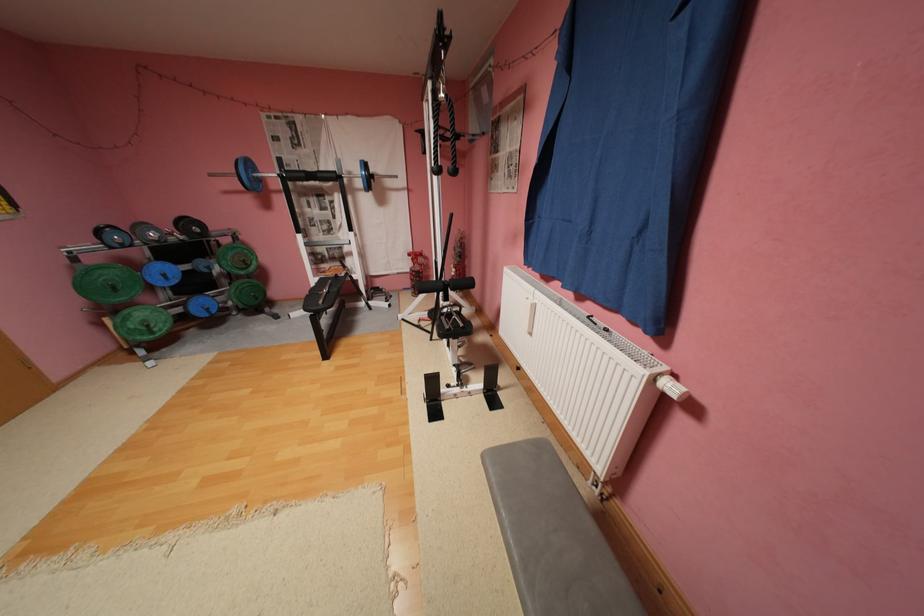
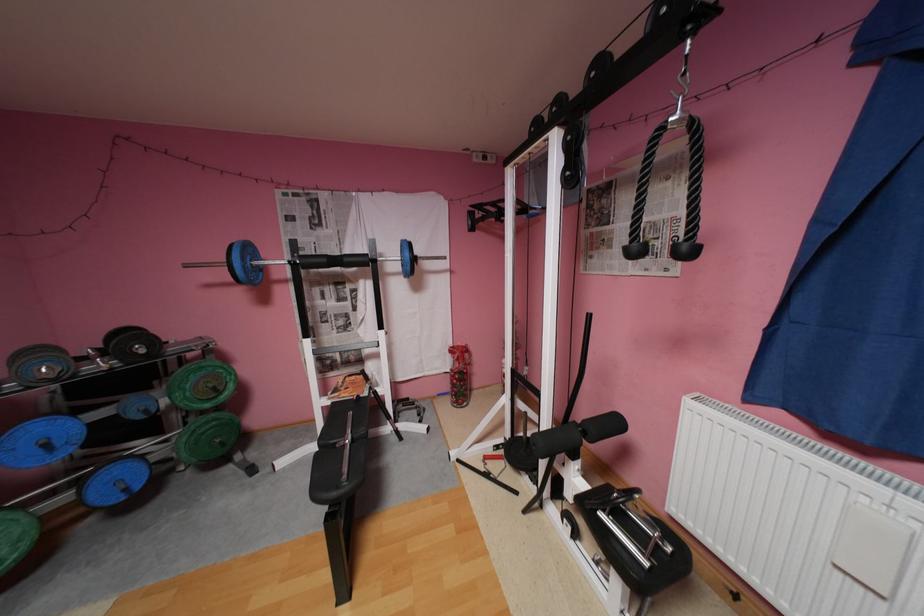
In the second image, find the point that corresponds to point (152, 225) in the first image.

(49, 351)